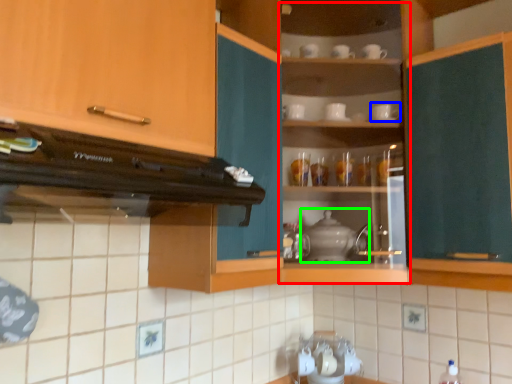
Question: Which object is the closest to the cabinet (highlighted by a red box)? Choose among these: tableware (highlighted by a blue box) or appliance (highlighted by a green box).

Choices:
 (A) tableware
 (B) appliance

Answer: (B)